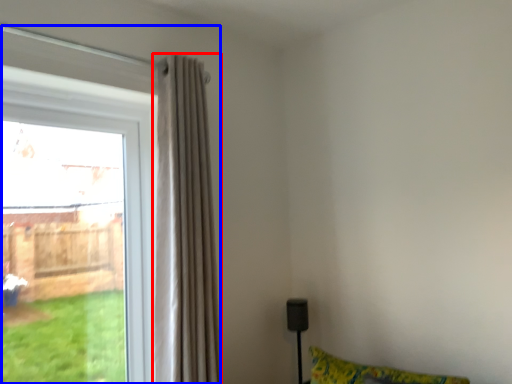
Question: Which of the following is the farthest to the observer, curtain (highlighted by a red box) or window (highlighted by a blue box)?

Choices:
 (A) curtain
 (B) window

Answer: (B)